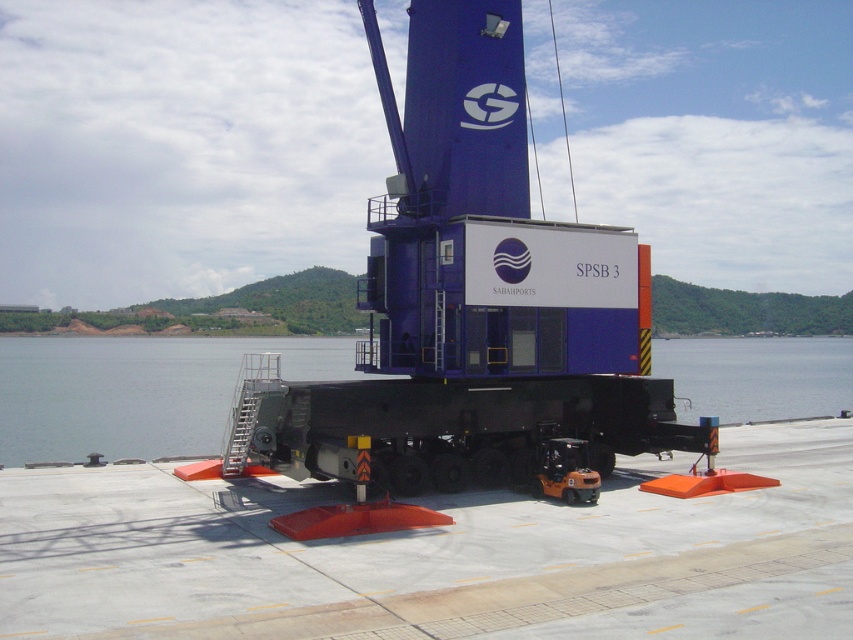
You are a crane operator standing at the control cabin of the mobile crane. You notice two points marked on the crane structure. The first point is at coordinate point (154, 547) and the second point is at coordinate point (715, 344). Which point is closer to your current position inside the cabin?

Point (154, 547) is closer to the camera than point (715, 344), so the first point is closer to your current position inside the cabin.

What is the coordinate of the concrete tarmac at center?

The concrete tarmac at center is located at coordinate point (438, 556).

You are a crane operator who needs to move a heavy container from the ground to the deck of a ship. The deck is at the same level as the transparent water at center. Can you safely lift the container over the concrete tarmac at center without hitting it?

The concrete tarmac at center has a lesser height compared to transparent water at center. Since the deck is at the same level as the transparent water, the container can be safely lifted over the concrete tarmac at center as it is shorter than the deck level.